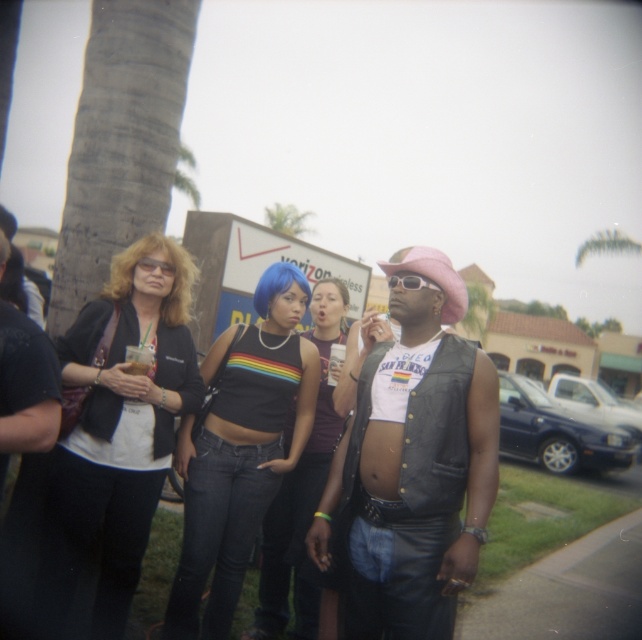
Is matte black jacket at left wider than rainbow striped tank top at center?

Incorrect, matte black jacket at left's width does not surpass rainbow striped tank top at center's.

Consider the image. Measure the distance between point (191,260) and camera.

They are 3.07 meters apart.

You are a GUI agent. You are given a task and a screenshot of the screen. Output one action in this format:
    pyautogui.click(x=<x>, y=<y>)
    Task: Click on the matte black jacket at left
    
    Given the screenshot: What is the action you would take?
    pyautogui.click(x=117, y=433)

Does leather vest at center have a smaller size compared to matte black jacket at left?

Indeed, leather vest at center has a smaller size compared to matte black jacket at left.

Where is `leather vest at center`? This screenshot has width=642, height=640. leather vest at center is located at coordinates (413, 465).

Locate an element on the screen. leather vest at center is located at coordinates (413, 465).

How much distance is there between leather vest at center and green leafy palm tree at upper center?

leather vest at center and green leafy palm tree at upper center are 35.35 meters apart.

From the picture: Does leather vest at center have a larger size compared to green leafy palm tree at upper center?

No.

Is point (469, 492) positioned in front of point (279, 221)?

That is True.

In order to click on leather vest at center in this screenshot , I will do `click(413, 465)`.